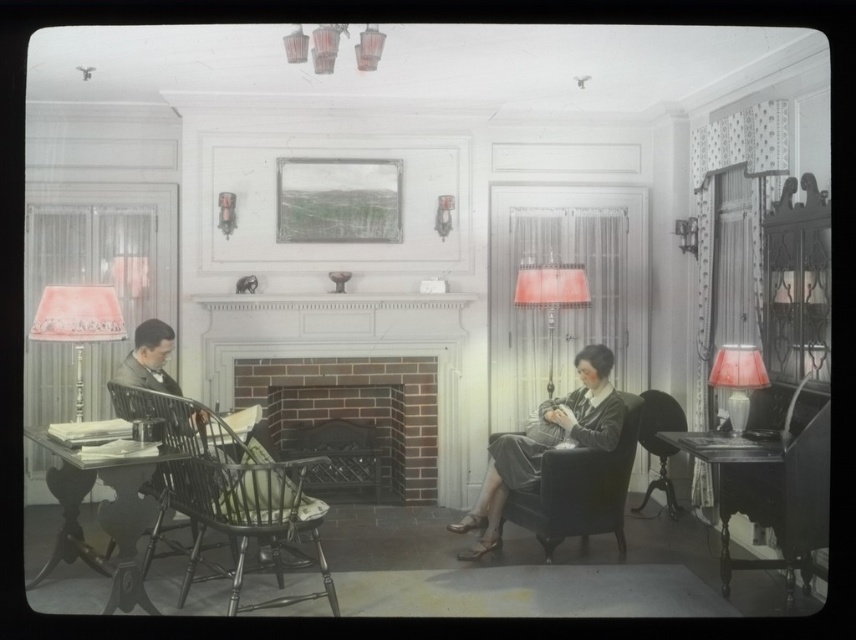
You are sitting in the black wood armchair at center and want to move to the velvet dark blue armchair at center. Which direction should you move to reach it?

The black wood armchair at center is to the left of the velvet dark blue armchair at center, so you should move to the right to reach it.

From the picture: You are sitting in the black wood armchair at center and want to reach the matte red lampshade at right. Is the lampshade visible from your current position?

The black wood armchair at center is in front of the matte red lampshade at right, so the lampshade is behind the chair and not visible from your current position.

You are standing at point [173,492] in the room. The nearest exit is 5 meters away. Can you reach the exit without moving more than 4 meters?

The nearest exit is 5 meters away, so you cannot reach it without moving more than 4 meters.